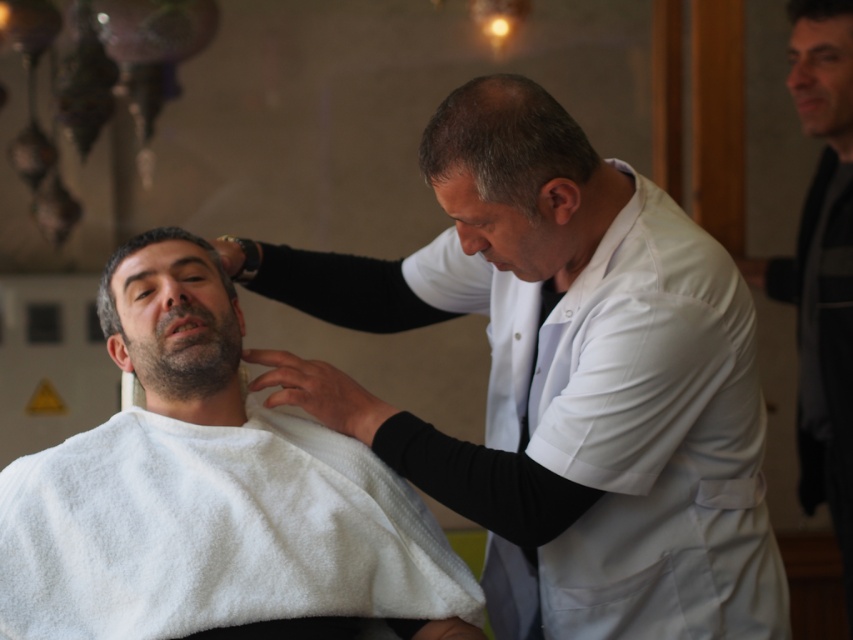
You are a customer in the barbershop and want to know which object is taller between the black matte jacket at right and the dark brown hair at center. Can you tell me?

The black matte jacket at right is much taller than the dark brown hair at center.

You are a customer entering the barbershop and want to sit in the chair. There is a black matte jacket at right and a dark brown hair at center in the image. Which object is located to the right of the other?

The black matte jacket at right is to the right of dark brown hair at center.